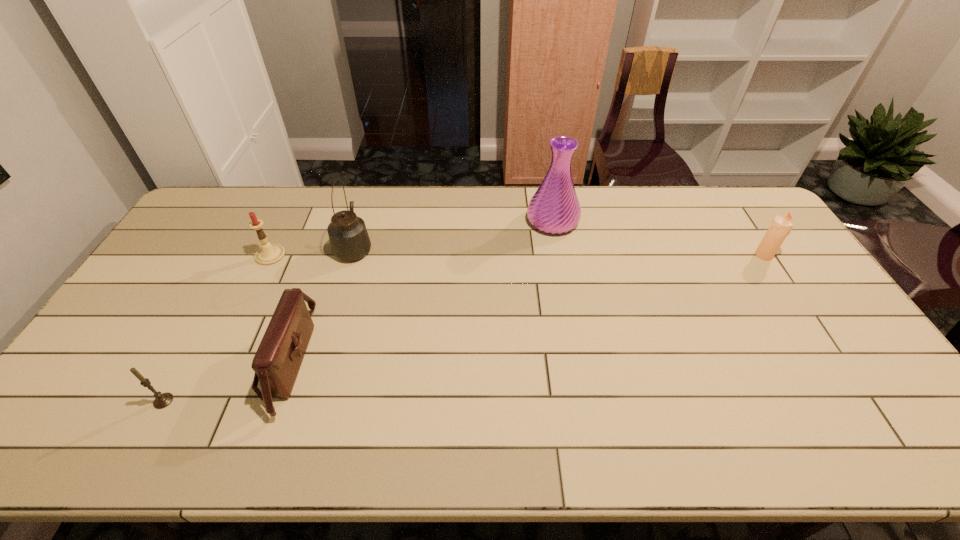
You are a GUI agent. You are given a task and a screenshot of the screen. Output one action in this format:
    pyautogui.click(x=<x>, y=<y>)
    Task: Click on the free spot located on the front of the rightmost object
    Image resolution: width=960 pixels, height=540 pixels.
    Given the screenshot: What is the action you would take?
    pyautogui.click(x=778, y=277)

Find the location of a particular element. The height and width of the screenshot is (540, 960). vacant space located on the right of the fifth object from right to left is located at coordinates (383, 255).

Find the location of a particular element. The height and width of the screenshot is (540, 960). vacant space located 0.400m on the front flap of the shoulder bag is located at coordinates point(462,361).

Find the location of a particular element. The image size is (960, 540). free space located on the right of the nearest candle is located at coordinates (283, 401).

This screenshot has width=960, height=540. In order to click on object that is positioned at the far edge in this screenshot , I will do `click(554, 208)`.

At what (x,y) coordinates should I click in order to perform the action: click on object located in the near edge section of the desktop. Please return your answer as a coordinate pair (x, y). The height and width of the screenshot is (540, 960). Looking at the image, I should click on (278, 359).

Identify the location of object that is positioned at the right edge. (780, 227).

This screenshot has height=540, width=960. I want to click on free space at the far edge, so click(x=599, y=210).

Identify the location of vacant area at the near edge of the desktop. (801, 447).

Image resolution: width=960 pixels, height=540 pixels. What are the coordinates of `free space at the right edge` in the screenshot? It's located at (853, 367).